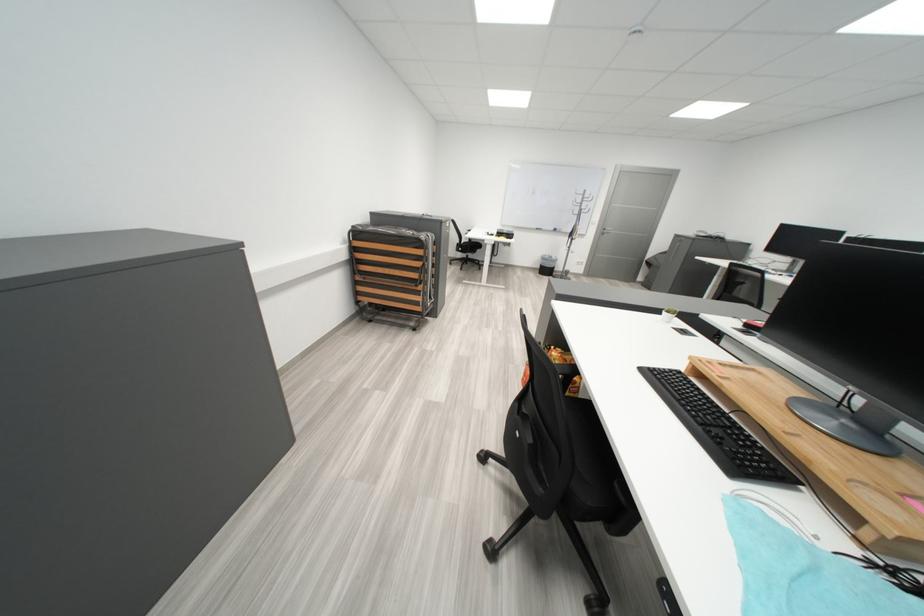
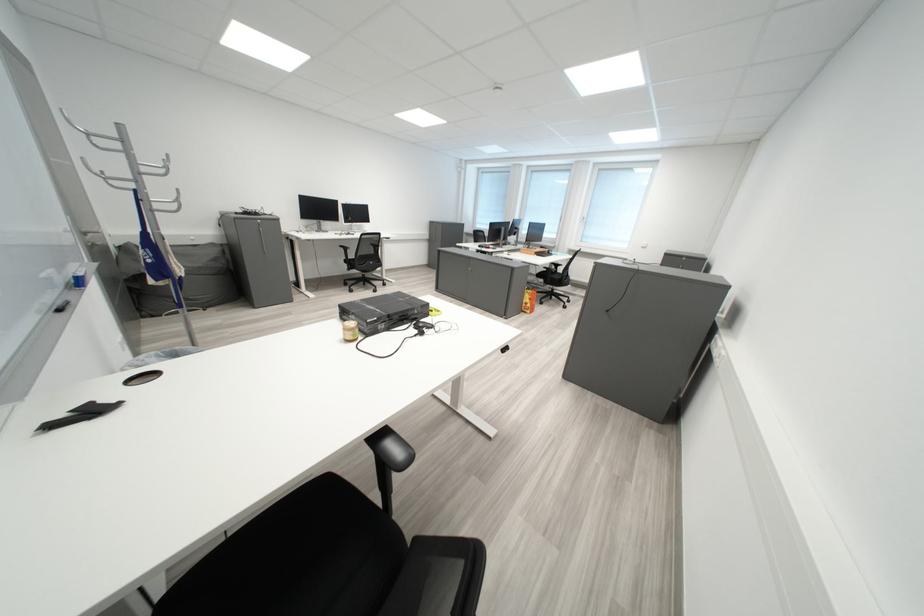
In the second image, find the point that corresponds to the point at 473,355 in the first image.

(574, 333)